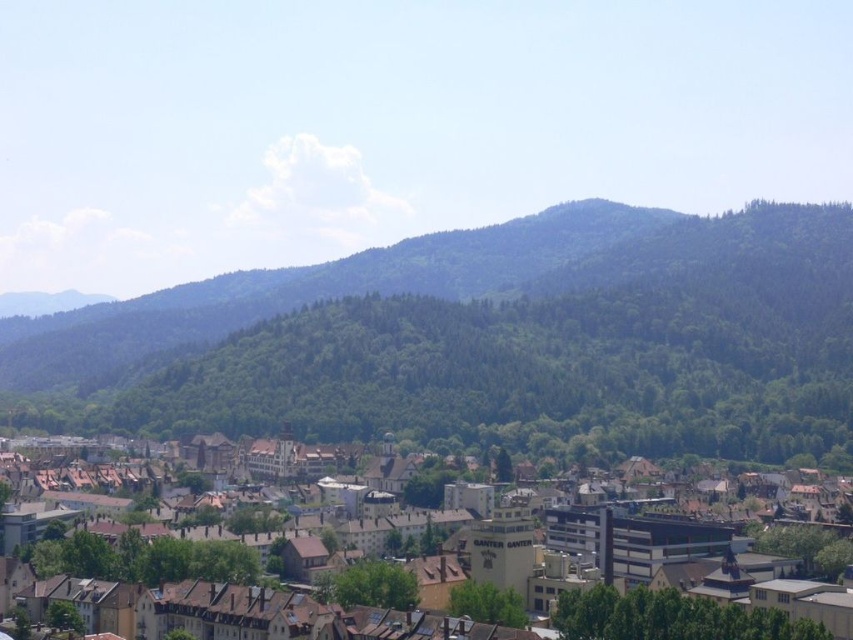
Question: Can you confirm if green forested mountain at center is positioned below brown wooden houses at center?

Choices:
 (A) yes
 (B) no

Answer: (B)

Question: Which object appears closest to the camera in this image?

Choices:
 (A) brown wooden houses at center
 (B) green forested mountain at center

Answer: (A)

Question: Among these points, which one is farthest from the camera?

Choices:
 (A) (766, 348)
 (B) (277, 616)

Answer: (A)

Question: Can you confirm if green forested mountain at center is thinner than brown wooden houses at center?

Choices:
 (A) yes
 (B) no

Answer: (B)

Question: Which point is closer to the camera?

Choices:
 (A) green forested mountain at center
 (B) brown wooden houses at center

Answer: (B)

Question: Can you confirm if green forested mountain at center is smaller than brown wooden houses at center?

Choices:
 (A) yes
 (B) no

Answer: (B)